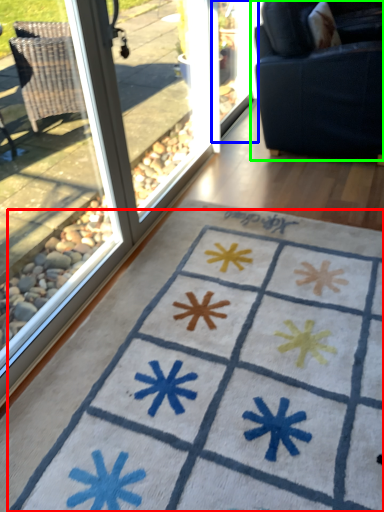
Question: Considering the real-world distances, which object is farthest from doormat (highlighted by a red box)? screen door (highlighted by a blue box) or studio couch (highlighted by a green box)?

Choices:
 (A) screen door
 (B) studio couch

Answer: (A)